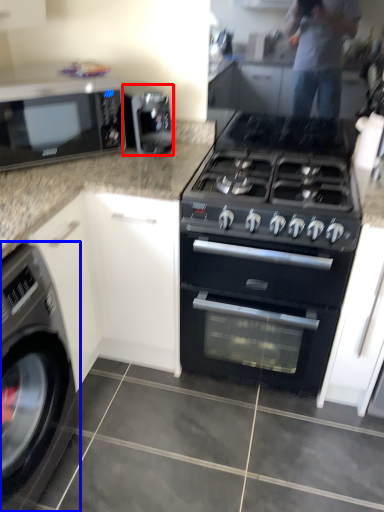
Question: Among these objects, which one is nearest to the camera, appliance (highlighted by a red box) or washing machine (highlighted by a blue box)?

Choices:
 (A) appliance
 (B) washing machine

Answer: (B)